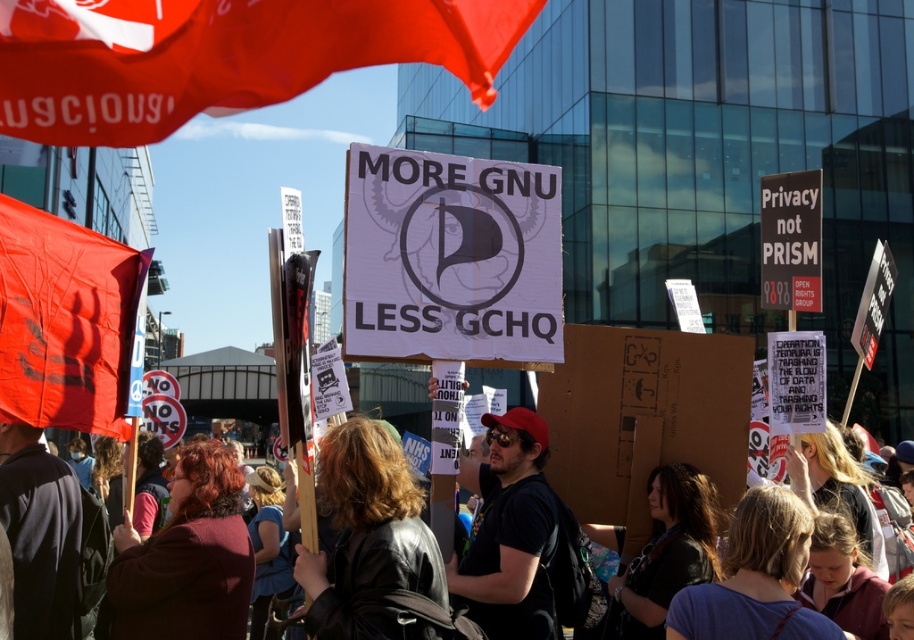
Does dark brown leather jacket at lower left appear on the right side of black leather jacket at center?

In fact, dark brown leather jacket at lower left is to the left of black leather jacket at center.

Consider the image. Who is more forward, (120, 534) or (29, 612)?

Positioned in front is point (29, 612).

This screenshot has height=640, width=914. In order to click on dark brown leather jacket at lower left in this screenshot , I will do `click(186, 557)`.

Can you confirm if matte red flag at left is positioned below leather jacket at center?

No, matte red flag at left is not below leather jacket at center.

Who is shorter, matte red flag at left or leather jacket at center?

leather jacket at center is shorter.

At what (x,y) coordinates should I click in order to perform the action: click on matte red flag at left. Please return your answer as a coordinate pair (x, y). This screenshot has width=914, height=640. Looking at the image, I should click on (65, 321).

Which is in front, point (89, 44) or point (686, 612)?

Point (89, 44)

Which is more to the right, matte red flag at upper left or blonde hair at center?

blonde hair at center is more to the right.

What do you see at coordinates (221, 56) in the screenshot? This screenshot has height=640, width=914. I see `matte red flag at upper left` at bounding box center [221, 56].

Locate an element on the screen. Image resolution: width=914 pixels, height=640 pixels. matte red flag at upper left is located at coordinates (221, 56).